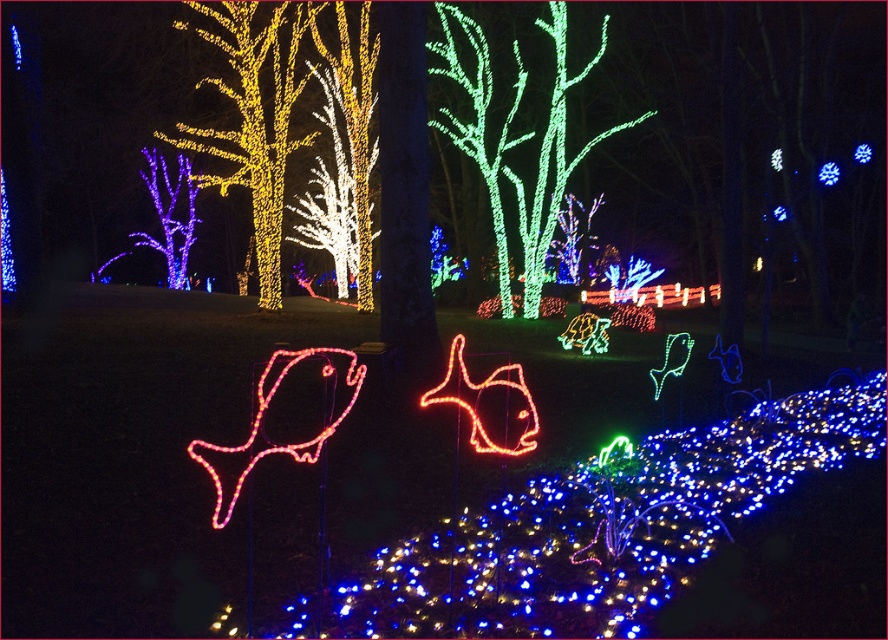
Question: Which of these objects is positioned closest to the blue led lights at center?

Choices:
 (A) yellow illuminated tree at upper left
 (B) purple illuminated tree at upper left
 (C) green illuminated tree at center

Answer: (C)

Question: Does yellow illuminated tree at upper left come in front of purple illuminated tree at upper left?

Choices:
 (A) no
 (B) yes

Answer: (B)

Question: Which point appears farthest from the camera in this image?

Choices:
 (A) (546, 22)
 (B) (172, 252)
 (C) (818, 170)

Answer: (B)

Question: Is yellow illuminated tree at upper left smaller than purple illuminated tree at upper left?

Choices:
 (A) no
 (B) yes

Answer: (A)

Question: Does yellow illuminated tree at upper left appear on the left side of blue led lights at center?

Choices:
 (A) yes
 (B) no

Answer: (A)

Question: Which point is closer to the camera taking this photo?

Choices:
 (A) (168, 220)
 (B) (155, 134)
 (C) (836, 180)

Answer: (B)